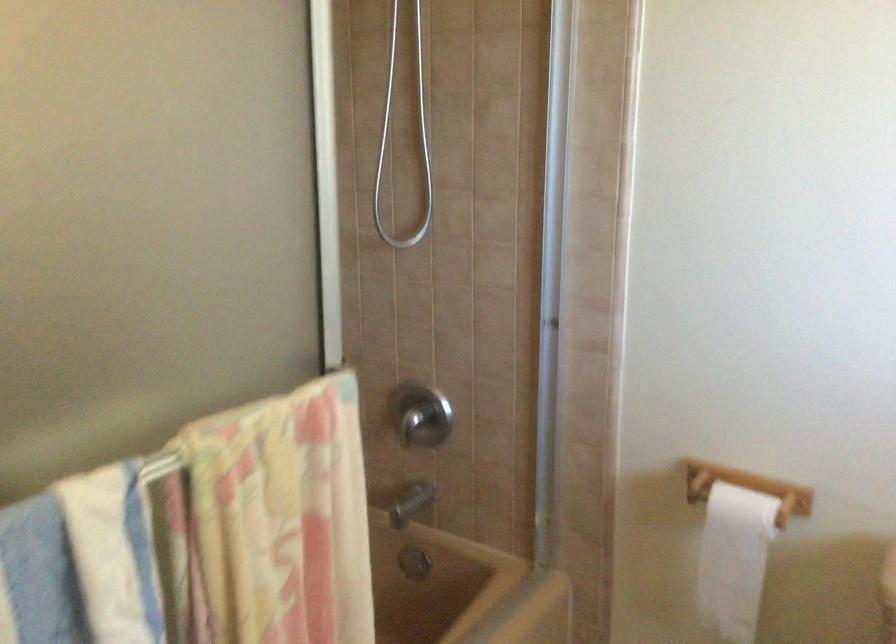
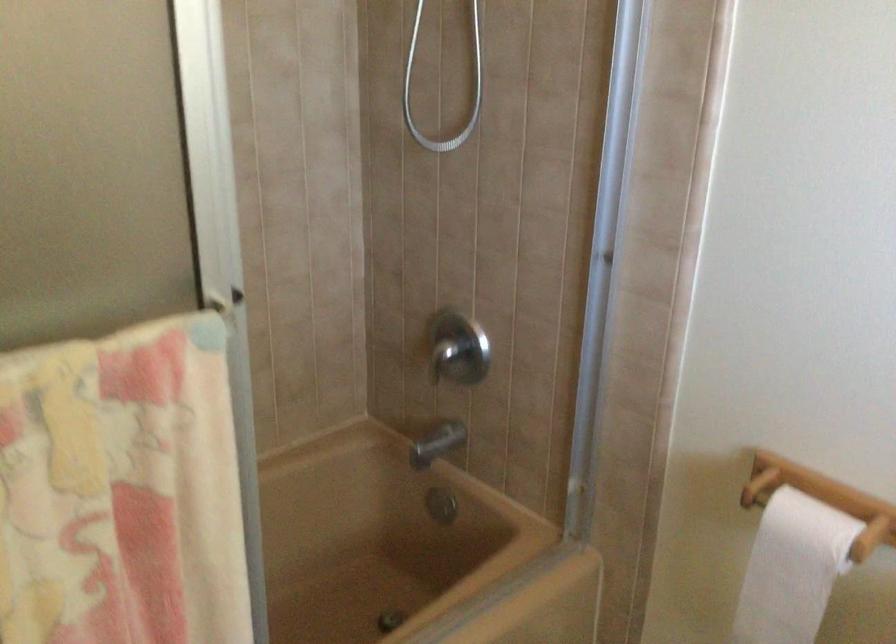
The images are taken continuously from a first-person perspective. In which direction are you moving?

The cameraman moved toward right, forward.